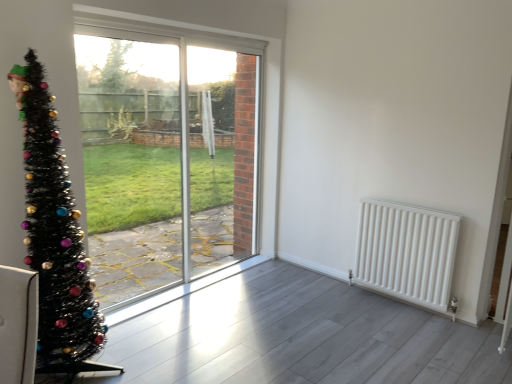
The height and width of the screenshot is (384, 512). Identify the location of free point above transparent glass window at center (from a real-world perspective). (172, 25).